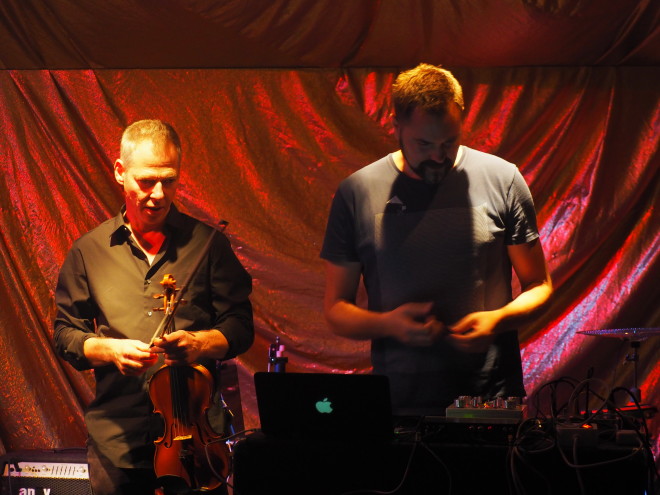
This screenshot has height=495, width=660. Find the location of `amplifier`. amplifier is located at coordinates (50, 485), (265, 134).